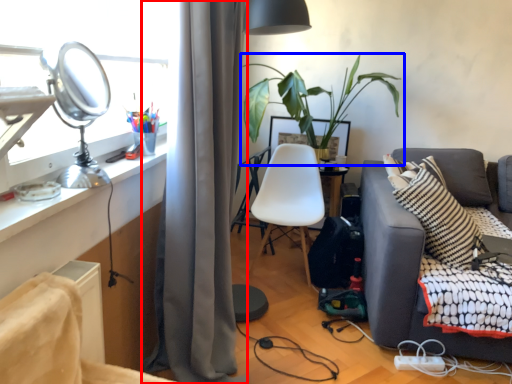
Question: Among these objects, which one is nearest to the camera, curtain (highlighted by a red box) or houseplant (highlighted by a blue box)?

Choices:
 (A) curtain
 (B) houseplant

Answer: (A)